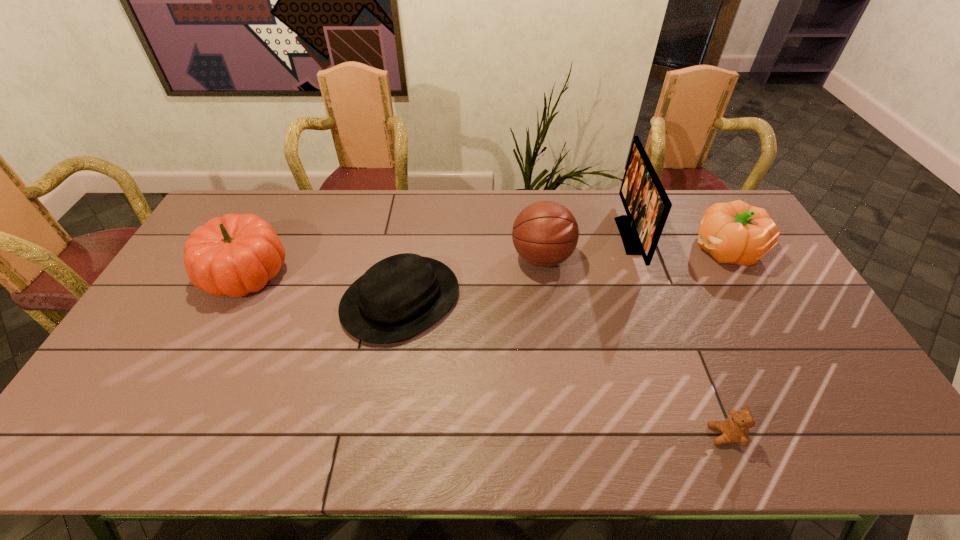
Locate an element on the screen. unoccupied area between the tallest object and the leftmost object is located at coordinates (438, 254).

I want to click on empty location between the nearest object and the right pumpkin, so click(725, 342).

This screenshot has height=540, width=960. What are the coordinates of `free space that is in between the monitor and the second object from left to right` in the screenshot? It's located at (516, 268).

The image size is (960, 540). In order to click on free spot between the right pumpkin and the fifth object from right to left in this screenshot , I will do `click(564, 274)`.

The height and width of the screenshot is (540, 960). In order to click on vacant region between the second object from left to right and the right pumpkin in this screenshot , I will do `click(564, 274)`.

The width and height of the screenshot is (960, 540). In order to click on vacant space that's between the nearest object and the rightmost object in this screenshot , I will do `click(725, 342)`.

Where is `vacant space that is in between the leftmost object and the monitor`? This screenshot has width=960, height=540. vacant space that is in between the leftmost object and the monitor is located at coordinates (438, 254).

This screenshot has width=960, height=540. Identify the location of empty space between the nearest object and the rightmost object. (725, 342).

Find the location of a particular element. Image resolution: width=960 pixels, height=540 pixels. object identified as the third closest to the leftmost object is located at coordinates (647, 205).

Choose which object is the nearest neighbor to the fedora. Please provide its 2D coordinates. Your answer should be formatted as a tuple, i.e. [(x, y)], where the tuple contains the x and y coordinates of a point satisfying the conditions above.

[(545, 233)]